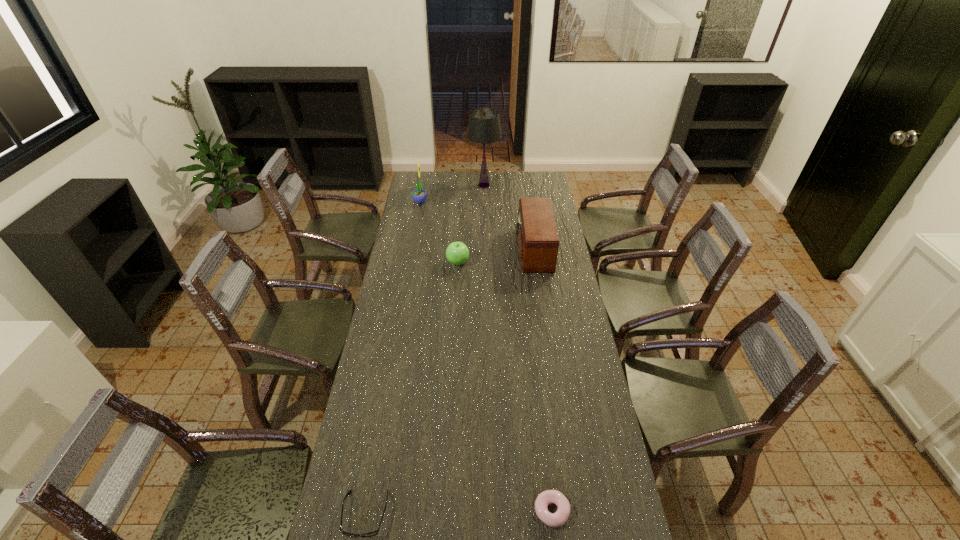
In order to click on free space located on the front-facing side of the fourth shortest object in this screenshot , I will do `click(493, 249)`.

The image size is (960, 540). I want to click on free space located 0.370m on the front-facing side of the fourth shortest object, so click(x=440, y=249).

Where is `vacant space situated 0.210m on the front of the apple`? This screenshot has height=540, width=960. vacant space situated 0.210m on the front of the apple is located at coordinates (456, 302).

The image size is (960, 540). Find the location of `vacant space located 0.140m on the back of the doughnut`. vacant space located 0.140m on the back of the doughnut is located at coordinates (544, 447).

Find the location of a particular element. The width and height of the screenshot is (960, 540). object located at the far edge is located at coordinates (484, 127).

Identify the location of object that is positioned at the left edge. click(x=419, y=195).

Identify the location of radio receiver at the right edge. The image size is (960, 540). (538, 241).

The width and height of the screenshot is (960, 540). I want to click on doughnut that is at the right edge, so 559,518.

This screenshot has height=540, width=960. In the image, there is a desktop. In order to click on vacant region at the far edge in this screenshot , I will do `click(439, 177)`.

You are a GUI agent. You are given a task and a screenshot of the screen. Output one action in this format:
    pyautogui.click(x=<x>, y=<y>)
    Task: Click on the vacant space at the left edge
    The width and height of the screenshot is (960, 540).
    Given the screenshot: What is the action you would take?
    pyautogui.click(x=400, y=226)